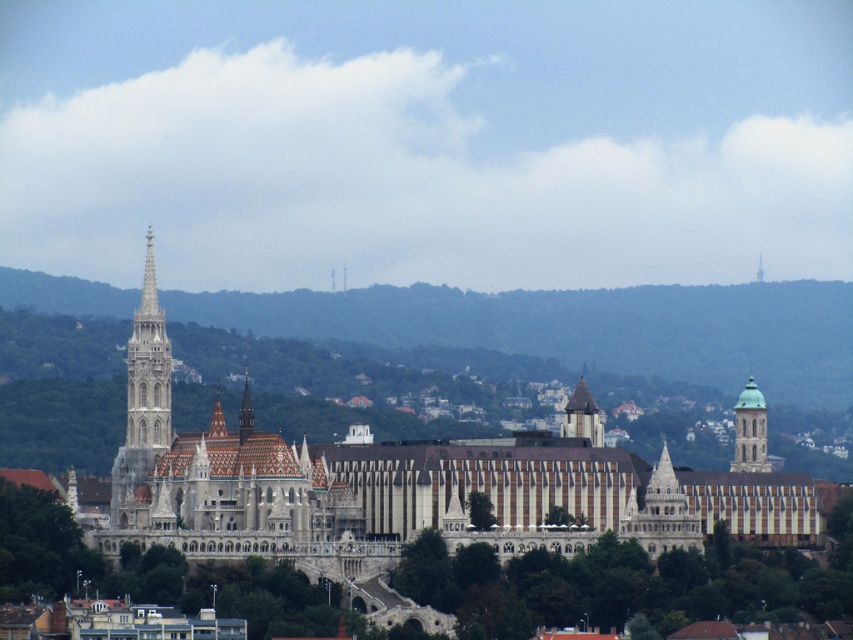
You are an architect analyzing the historic cityscape. You notice two structures in the center of the image. The first is the smooth stone tower at center, and the second is the smooth stone spire at center. Which of these two structures is narrower?

The smooth stone tower at center has a lesser width compared to the smooth stone spire at center, so the smooth stone tower at center is narrower.

Based on the photo, you are a tourist standing in the park area in front of the buildings. You want to take a photo that includes both the white stone palace at center and the white stone tower at left. Which building should you position closer to the camera to ensure both are fully visible in the frame?

You should position the white stone tower at left closer to the camera since it is shorter than the white stone palace at center. By placing the shorter tower in front, both structures will fit within the frame without one blocking the other.

You are a tourist standing in the park area in front of the historic cityscape. You want to take a photo that includes both the white stone palace at center and the smooth stone tower at center. Which one should you position to the left side of your photo to capture both in the frame?

You should position the white stone palace at center to the left side of your photo because it is already located to the left of the smooth stone tower at center in the scene.